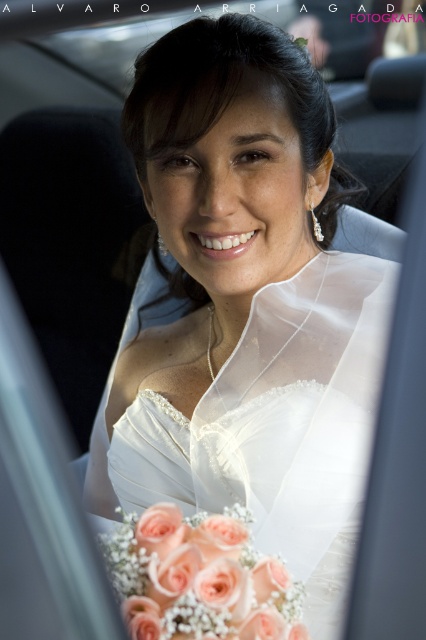
This screenshot has width=426, height=640. I want to click on white satin wedding dress at center, so click(261, 474).

At what (x,y) coordinates should I click in order to perform the action: click on white satin wedding dress at center. Please return your answer as a coordinate pair (x, y). Looking at the image, I should click on (261, 474).